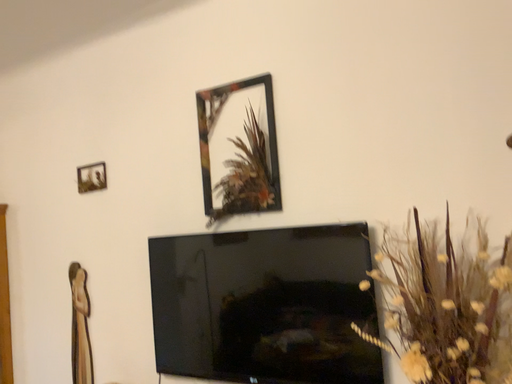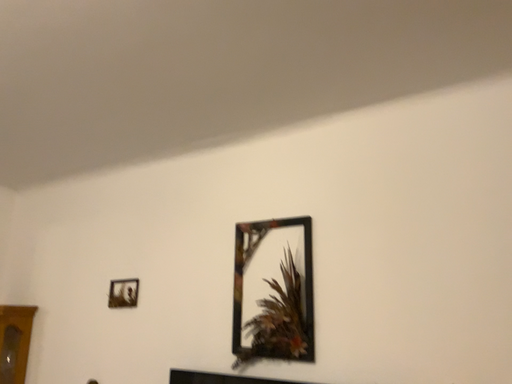
Question: How did the camera likely rotate when shooting the video?

Choices:
 (A) rotated upward
 (B) rotated downward

Answer: (A)